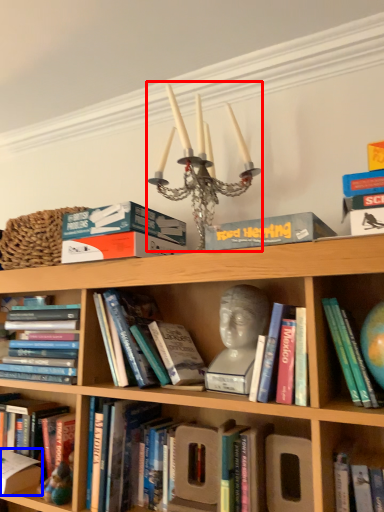
Question: Which of the following is the closest to the observer, candle holder (highlighted by a red box) or paperback book (highlighted by a blue box)?

Choices:
 (A) candle holder
 (B) paperback book

Answer: (A)